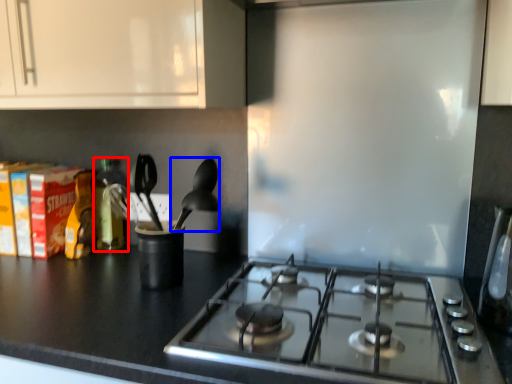
Question: Among these objects, which one is farthest to the camera, bottle (highlighted by a red box) or silverware (highlighted by a blue box)?

Choices:
 (A) bottle
 (B) silverware

Answer: (A)